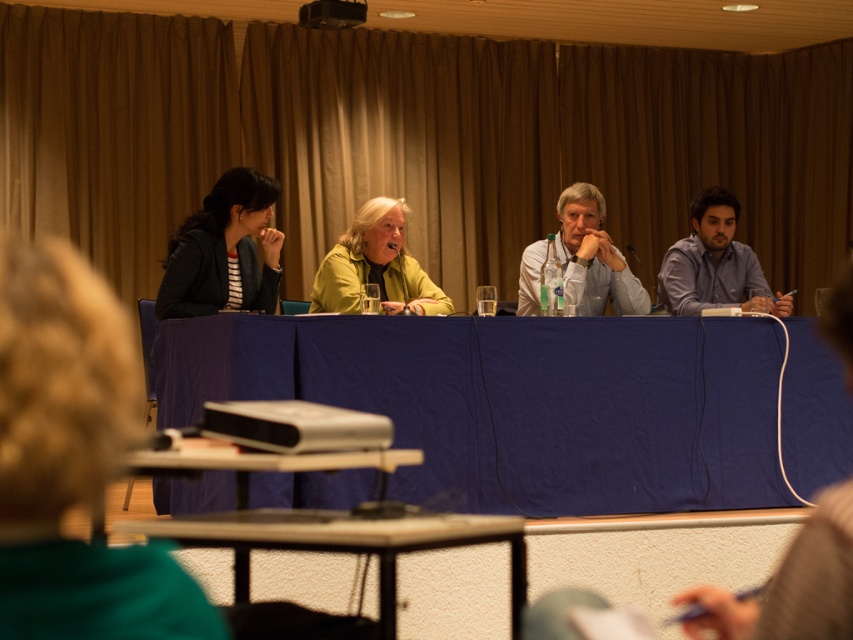
Question: Which point appears farthest from the camera in this image?

Choices:
 (A) (230, 177)
 (B) (511, 536)
 (C) (578, 298)
 (D) (666, 291)

Answer: (D)

Question: Which point is farther to the camera?

Choices:
 (A) white shirt at center
 (B) matte yellow jacket at center

Answer: (A)

Question: From the image, what is the correct spatial relationship of blue shirt at right in relation to white shirt at center?

Choices:
 (A) right
 (B) left

Answer: (A)

Question: Which point is farther to the camera?

Choices:
 (A) pos(207,198)
 (B) pos(403,259)

Answer: (B)

Question: Can you confirm if blue shirt at right is positioned to the left of white shirt at center?

Choices:
 (A) yes
 (B) no

Answer: (B)

Question: Observing the image, what is the correct spatial positioning of blue shirt at right in reference to white shirt at center?

Choices:
 (A) left
 (B) right

Answer: (B)